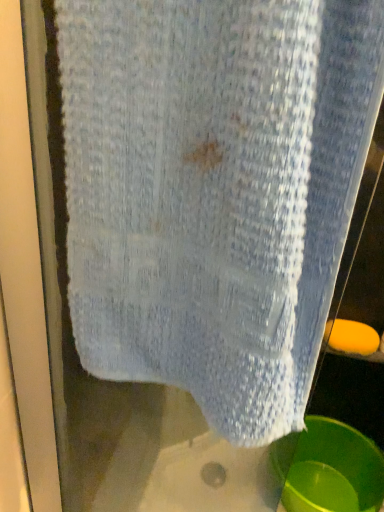
Question: Is green plastic basin at lower right directly adjacent to orange matte soap at lower right?

Choices:
 (A) yes
 (B) no

Answer: (B)

Question: Is green plastic basin at lower right facing towards orange matte soap at lower right?

Choices:
 (A) yes
 (B) no

Answer: (B)

Question: From the image's perspective, is green plastic basin at lower right beneath orange matte soap at lower right?

Choices:
 (A) no
 (B) yes

Answer: (B)

Question: Is green plastic basin at lower right further to the viewer compared to orange matte soap at lower right?

Choices:
 (A) yes
 (B) no

Answer: (B)

Question: From the image's perspective, is green plastic basin at lower right located above orange matte soap at lower right?

Choices:
 (A) yes
 (B) no

Answer: (B)

Question: Can you confirm if green plastic basin at lower right is positioned to the left of orange matte soap at lower right?

Choices:
 (A) yes
 (B) no

Answer: (A)

Question: Considering the relative sizes of orange matte soap at lower right and green plastic basin at lower right in the image provided, is orange matte soap at lower right taller than green plastic basin at lower right?

Choices:
 (A) yes
 (B) no

Answer: (B)

Question: Does orange matte soap at lower right have a greater width compared to green plastic basin at lower right?

Choices:
 (A) no
 (B) yes

Answer: (A)

Question: Considering the relative sizes of orange matte soap at lower right and green plastic basin at lower right in the image provided, is orange matte soap at lower right smaller than green plastic basin at lower right?

Choices:
 (A) no
 (B) yes

Answer: (B)

Question: From the image's perspective, would you say orange matte soap at lower right is shown under green plastic basin at lower right?

Choices:
 (A) yes
 (B) no

Answer: (B)

Question: Considering the relative sizes of orange matte soap at lower right and green plastic basin at lower right in the image provided, is orange matte soap at lower right thinner than green plastic basin at lower right?

Choices:
 (A) yes
 (B) no

Answer: (A)

Question: Can you confirm if orange matte soap at lower right is shorter than green plastic basin at lower right?

Choices:
 (A) no
 (B) yes

Answer: (B)

Question: From their relative heights in the image, would you say green plastic basin at lower right is taller or shorter than orange matte soap at lower right?

Choices:
 (A) short
 (B) tall

Answer: (B)